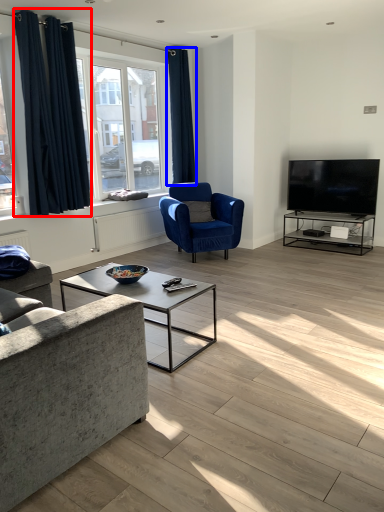
Question: Which object is further to the camera taking this photo, curtain (highlighted by a red box) or curtain (highlighted by a blue box)?

Choices:
 (A) curtain
 (B) curtain

Answer: (B)